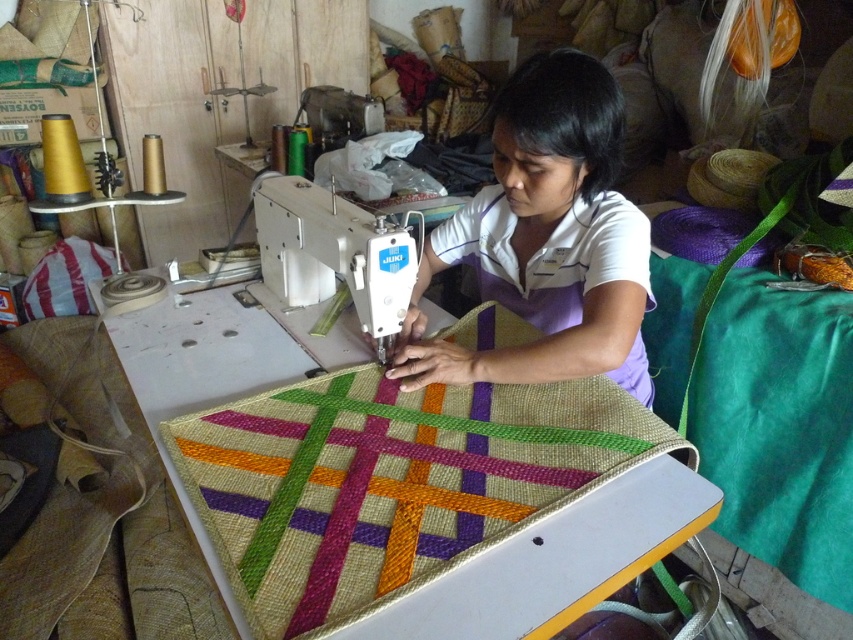
You are a tailor working in the workshop. You need to place a new fabric roll on the table between the white cotton shirt at center and the white plastic sewing machine at center. Can you tell me which side of the sewing machine you should place it on?

The white cotton shirt at center is to the right of the white plastic sewing machine at center, so to place the fabric roll between them, you should put it to the right side of the sewing machine.

Based on the photo, you are a tailor working in the workshop. You need to retrieve the white cotton shirt at center to check its stitching. However, the woven fabric quilt at center is blocking your access. Can you lift the quilt to reach the shirt?

The woven fabric quilt at center is located below the white cotton shirt at center, so you cannot lift the quilt to reach the shirt because the quilt is already underneath the shirt.